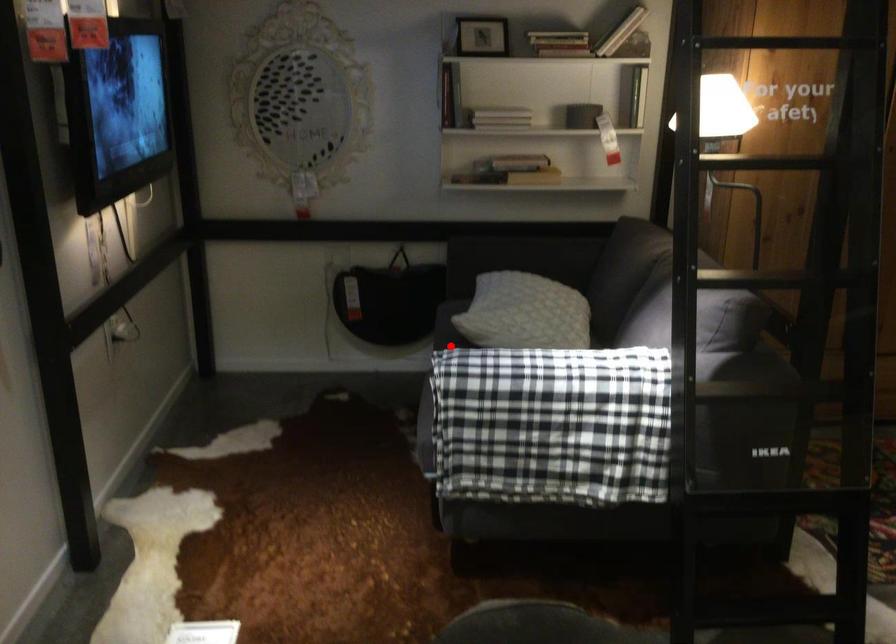
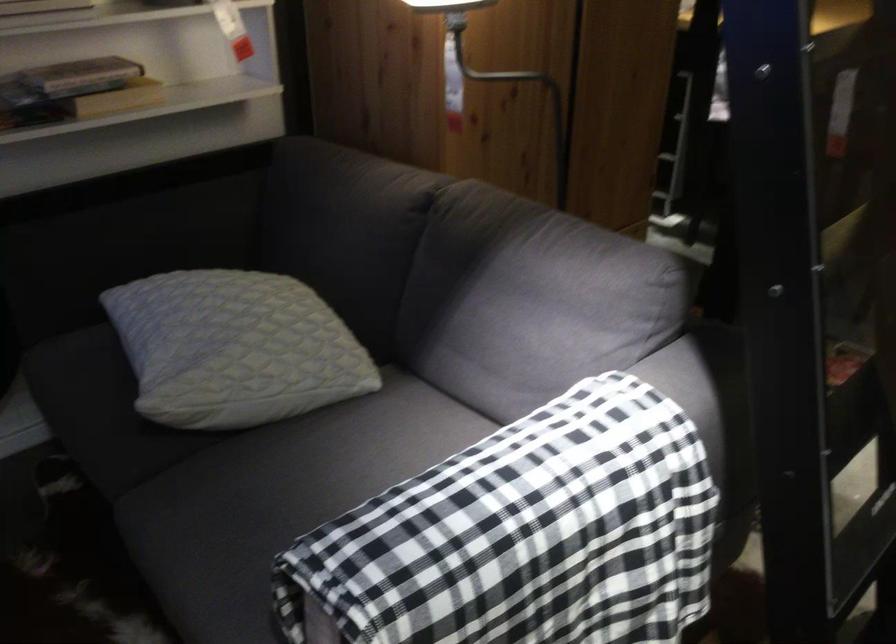
Question: I am providing you with two images of the same scene from different viewpoints. Given a red point in image1, look at the same physical point in image2. Is it:

Choices:
 (A) Closer to the viewpoint
 (B) Farther from the viewpoint

Answer: (A)